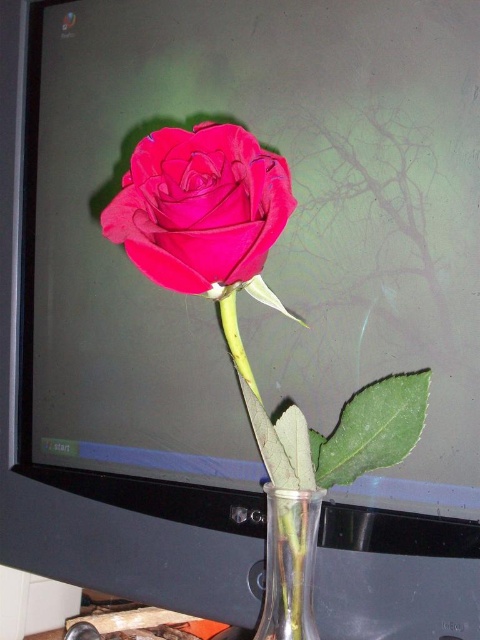
Question: Does matte velvet rose at center appear under transparent glass vase at lower center?

Choices:
 (A) yes
 (B) no

Answer: (B)

Question: Is matte velvet rose at center further to camera compared to transparent glass vase at lower center?

Choices:
 (A) no
 (B) yes

Answer: (A)

Question: Among these points, which one is farthest from the camera?

Choices:
 (A) (300, 518)
 (B) (263, 214)

Answer: (A)

Question: Does matte velvet rose at center appear over transparent glass vase at lower center?

Choices:
 (A) yes
 (B) no

Answer: (A)

Question: Which point is farther from the camera taking this photo?

Choices:
 (A) (159, 163)
 (B) (276, 561)

Answer: (B)